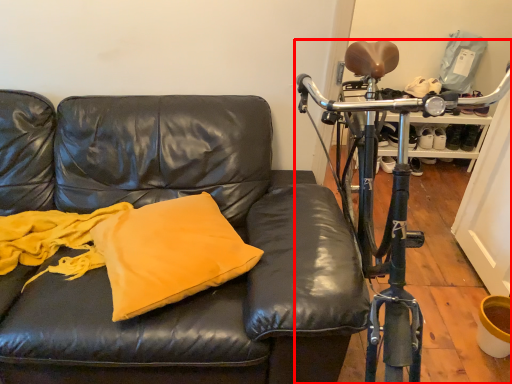
Question: From the image's perspective, what is the correct spatial positioning of bicycle (annotated by the red box) in reference to pillow?

Choices:
 (A) above
 (B) below

Answer: (A)